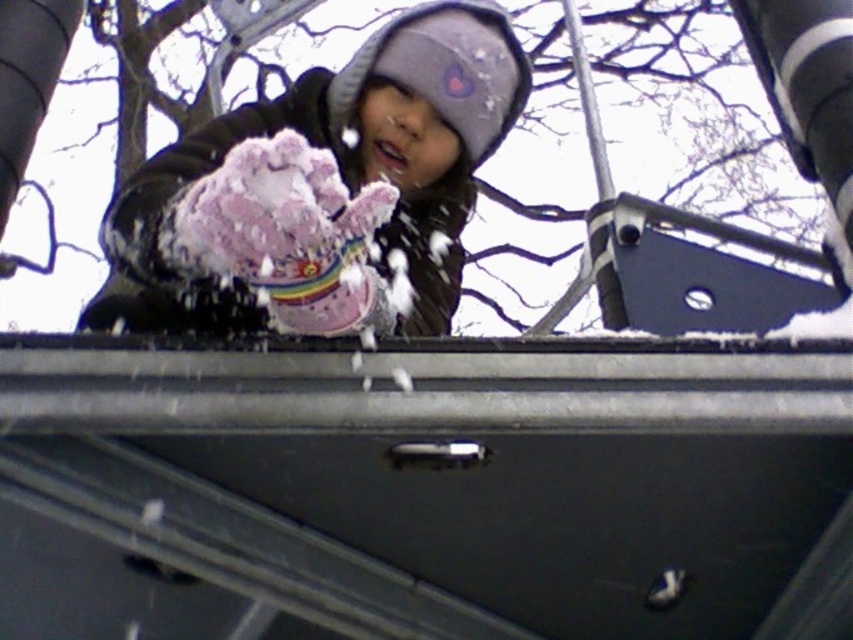
Is point (448, 276) closer to camera compared to point (334, 332)?

No, it is behind (334, 332).

Is point (219, 124) positioned after point (366, 275)?

Yes, point (219, 124) is behind point (366, 275).

Where is `pink fuzzy glove at center`? This screenshot has width=853, height=640. pink fuzzy glove at center is located at coordinates (340, 163).